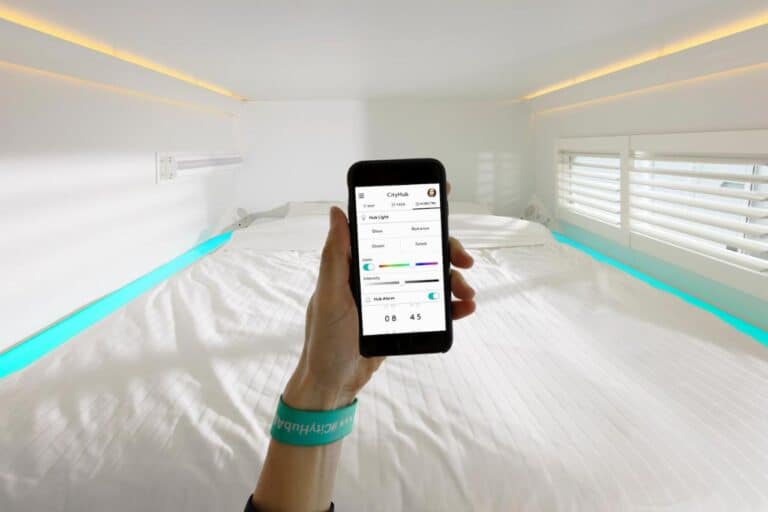
Identify the location of teal light. (157, 278), (659, 282).